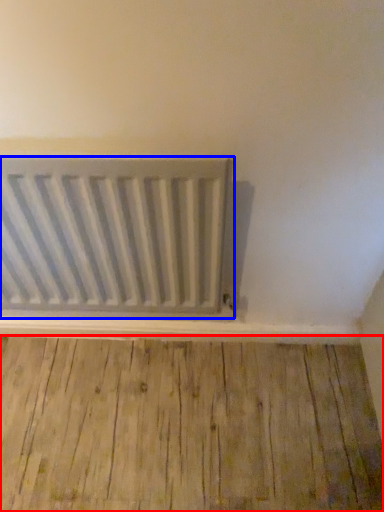
Question: Which object appears closest to the camera in this image, hardwood (highlighted by a red box) or radiator (highlighted by a blue box)?

Choices:
 (A) hardwood
 (B) radiator

Answer: (B)